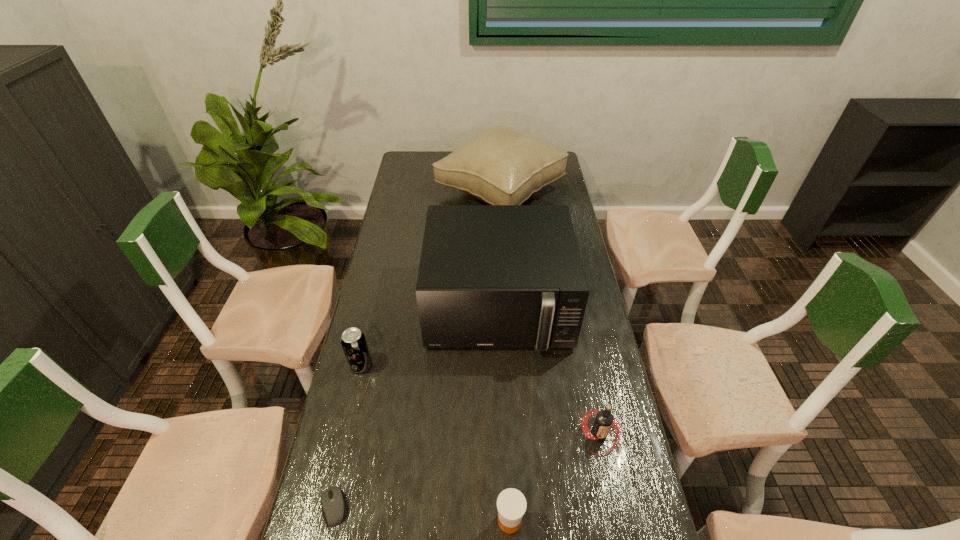
The height and width of the screenshot is (540, 960). I want to click on the farthest object, so click(x=501, y=165).

At what (x,y) coordinates should I click in order to perform the action: click on microwave oven. Please return your answer as a coordinate pair (x, y). Looking at the image, I should click on (490, 276).

Locate an element on the screen. The image size is (960, 540). soda can is located at coordinates (353, 341).

This screenshot has height=540, width=960. Identify the location of the third nearest object. click(604, 419).

I want to click on medicine, so 511,504.

Find the location of a particular element. the shortest object is located at coordinates (332, 500).

Where is `vacant region located 0.110m on the left of the farthest object`? The image size is (960, 540). vacant region located 0.110m on the left of the farthest object is located at coordinates (411, 192).

Locate an element on the screen. vacant position located 0.230m on the front-facing side of the microwave oven is located at coordinates (503, 429).

The width and height of the screenshot is (960, 540). Find the location of `blank space located 0.090m on the right of the soda can`. blank space located 0.090m on the right of the soda can is located at coordinates (401, 364).

Locate an element on the screen. The height and width of the screenshot is (540, 960). free spot located on the label of the third nearest object is located at coordinates (611, 488).